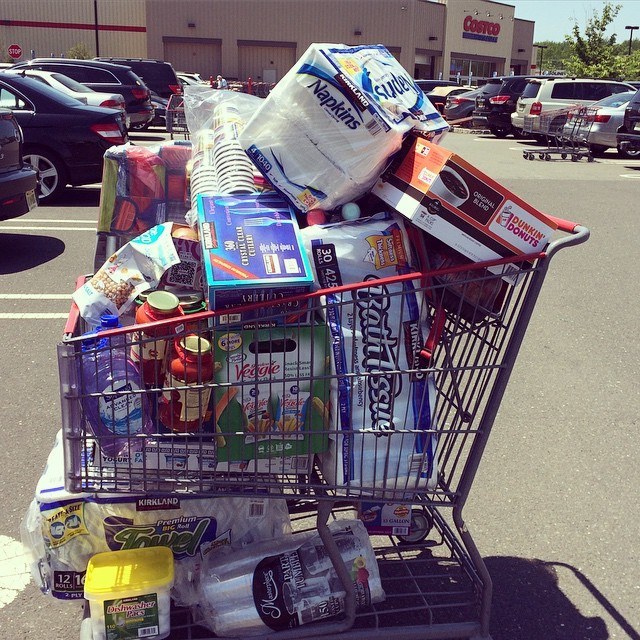
The image size is (640, 640). In order to click on dishwasher pods in this screenshot , I will do `click(134, 618)`.